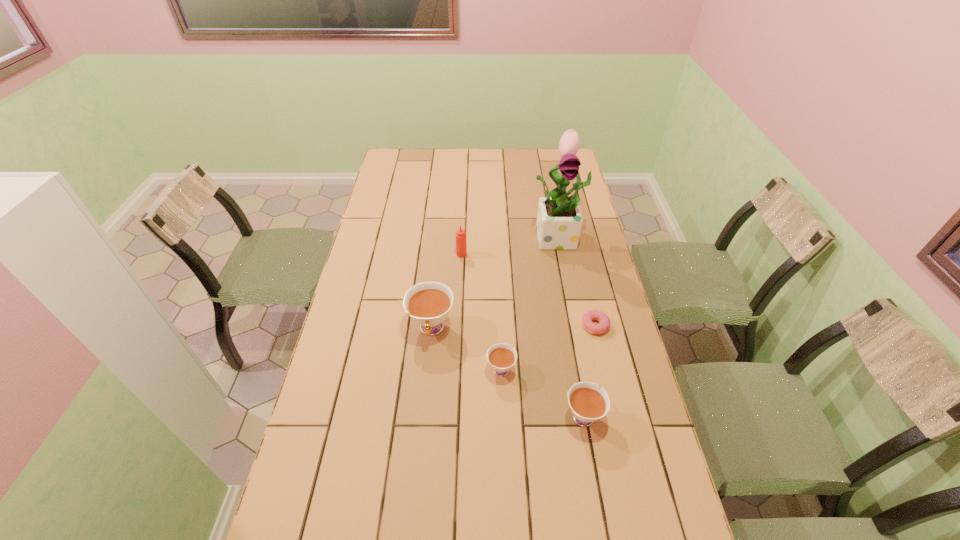
Where is `vacant space that satisfies the following two spatial constraints: 1. on the side of the nearest teacup with the handle; 2. on the left side of the doughnut`? vacant space that satisfies the following two spatial constraints: 1. on the side of the nearest teacup with the handle; 2. on the left side of the doughnut is located at coordinates (566, 326).

Identify the location of free point that satisfies the following two spatial constraints: 1. on the front-facing side of the doughnut; 2. on the left side of the tallest object. (577, 326).